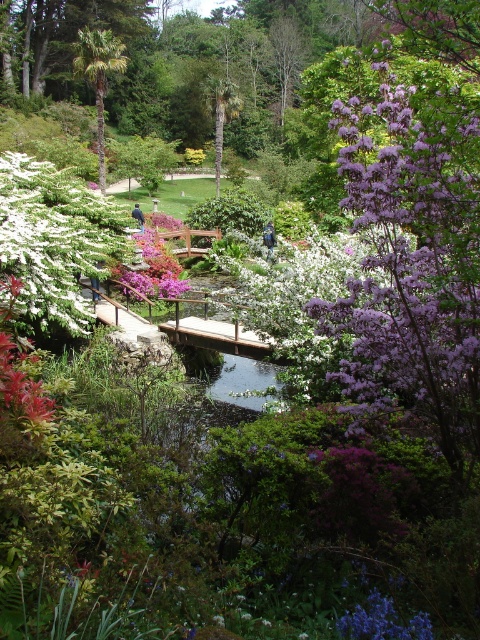
You are a gardener wanting to plant a new flower between the purple silky flower at upper right and the white matte flowers at left. Based on their positions, which flower should you place closer to the center of the garden?

The purple silky flower at upper right is in front of the white matte flowers at left, so to place the new flower between them, you should position it closer to the white matte flowers at left to maintain the spatial order.

You are a gardener standing at the center of the wooden bridge in the garden scene. You need to water both the white matte flowers at left and the green leafy palm tree at upper left. Which object is closer to you so you can prioritize watering it first?

The white matte flowers at left is closer to the gardener than the green leafy palm tree at upper left because it is only 24.04 meters away from the palm tree, so the flowers are nearer and should be watered first.